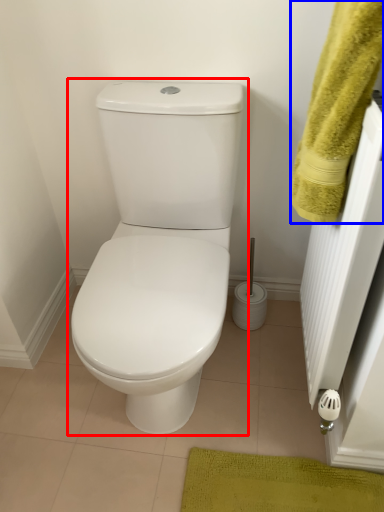
Question: Which point is further to the camera, toilet (highlighted by a red box) or bath towel (highlighted by a blue box)?

Choices:
 (A) toilet
 (B) bath towel

Answer: (A)